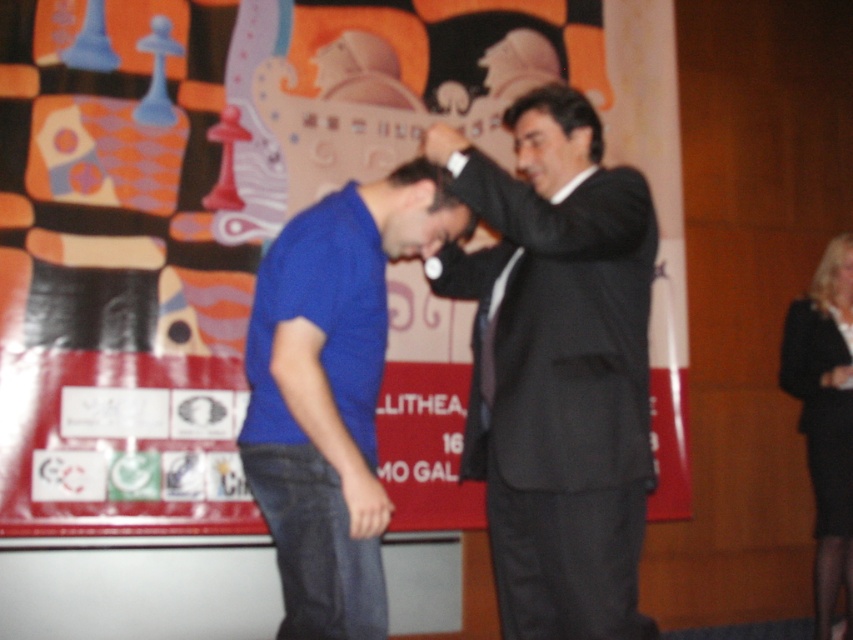
Based on the photo, who is positioned more to the right, blue cotton shirt at center or black fabric skirt at lower right?

black fabric skirt at lower right is more to the right.

Does blue cotton shirt at center have a smaller size compared to black fabric skirt at lower right?

No, blue cotton shirt at center is not smaller than black fabric skirt at lower right.

Which is in front, point (299, 531) or point (822, 269)?

Point (299, 531)

The image size is (853, 640). I want to click on blue cotton shirt at center, so click(x=332, y=392).

Image resolution: width=853 pixels, height=640 pixels. Describe the element at coordinates (251, 212) in the screenshot. I see `matte plastic chess piece at upper left` at that location.

Does matte plastic chess piece at upper left have a larger size compared to blue cotton shirt at center?

Yes, matte plastic chess piece at upper left is bigger than blue cotton shirt at center.

The width and height of the screenshot is (853, 640). I want to click on matte plastic chess piece at upper left, so click(251, 212).

Which is above, black suit at center or blue cotton shirt at center?

Positioned higher is black suit at center.

Does black suit at center have a greater width compared to blue cotton shirt at center?

Correct, the width of black suit at center exceeds that of blue cotton shirt at center.

This screenshot has width=853, height=640. I want to click on black suit at center, so click(556, 365).

Where is `black suit at center`? The width and height of the screenshot is (853, 640). black suit at center is located at coordinates (556, 365).